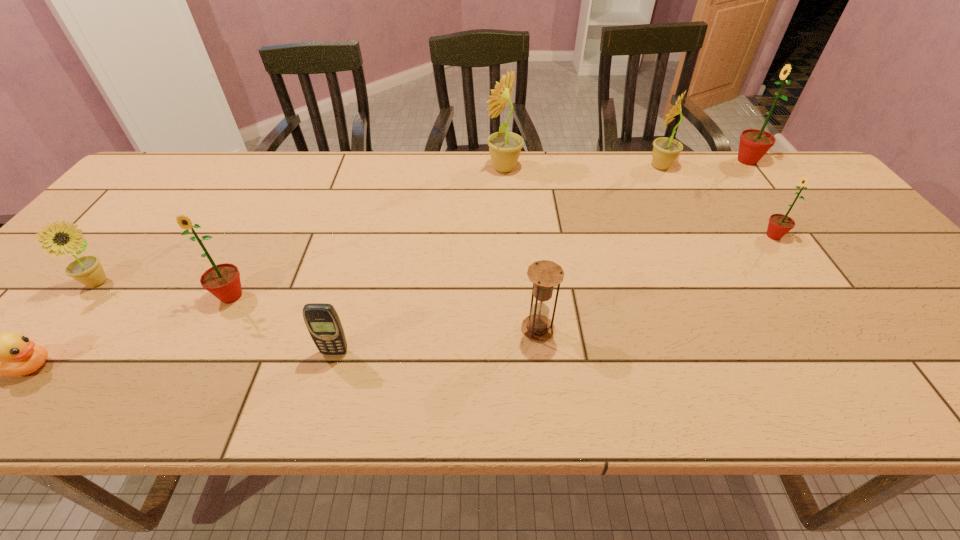
Image resolution: width=960 pixels, height=540 pixels. Find the location of `the second sunflower from right to left`. the second sunflower from right to left is located at coordinates (779, 225).

Find the location of a particular element. This screenshot has height=540, width=960. the third nearest sunflower is located at coordinates (779, 225).

Locate an element on the screen. This screenshot has height=540, width=960. hourglass is located at coordinates (544, 274).

This screenshot has height=540, width=960. I want to click on the seventh farthest object, so click(544, 274).

The image size is (960, 540). Identify the location of the fourth object from left to right. (322, 321).

Identify the location of gray cellular telephone. click(x=322, y=321).

Identify the location of vacant point located on the face of the second yellow sunflower from right to left. (383, 168).

Where is `free space located 0.280m on the face of the second yellow sunflower from right to left`? The image size is (960, 540). free space located 0.280m on the face of the second yellow sunflower from right to left is located at coordinates (396, 168).

Where is `free location located on the face of the second yellow sunflower from right to left`? free location located on the face of the second yellow sunflower from right to left is located at coordinates (428, 168).

This screenshot has width=960, height=540. In order to click on vacant area situated 0.400m on the face of the rightmost object in this screenshot , I will do `click(606, 161)`.